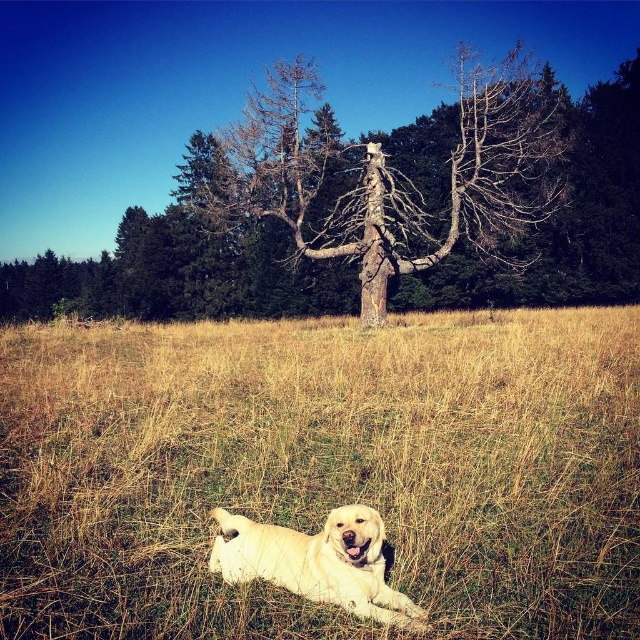
Can you confirm if golden grass at center is thinner than golden fur dog at center?

No.

Between golden grass at center and golden fur dog at center, which one appears on the left side from the viewer's perspective?

golden grass at center

Image resolution: width=640 pixels, height=640 pixels. Identify the location of golden grass at center. (323, 470).

Is bare wood tree at center above golden fur dog at center?

Indeed, bare wood tree at center is positioned over golden fur dog at center.

Does bare wood tree at center have a greater height compared to golden fur dog at center?

Correct, bare wood tree at center is much taller as golden fur dog at center.

Between point (560, 156) and point (364, 557), which one is positioned behind?

The point (560, 156) is more distant.

Where is `bare wood tree at center`? bare wood tree at center is located at coordinates (392, 173).

Who is higher up, golden grass at center or bare wood tree at center?

bare wood tree at center is above.

Which is in front, point (237, 600) or point (400, 202)?

Point (237, 600) is more forward.

Does point (125, 636) lie in front of point (474, 93)?

Yes, point (125, 636) is closer to viewer.

Locate an element on the screen. golden grass at center is located at coordinates (323, 470).